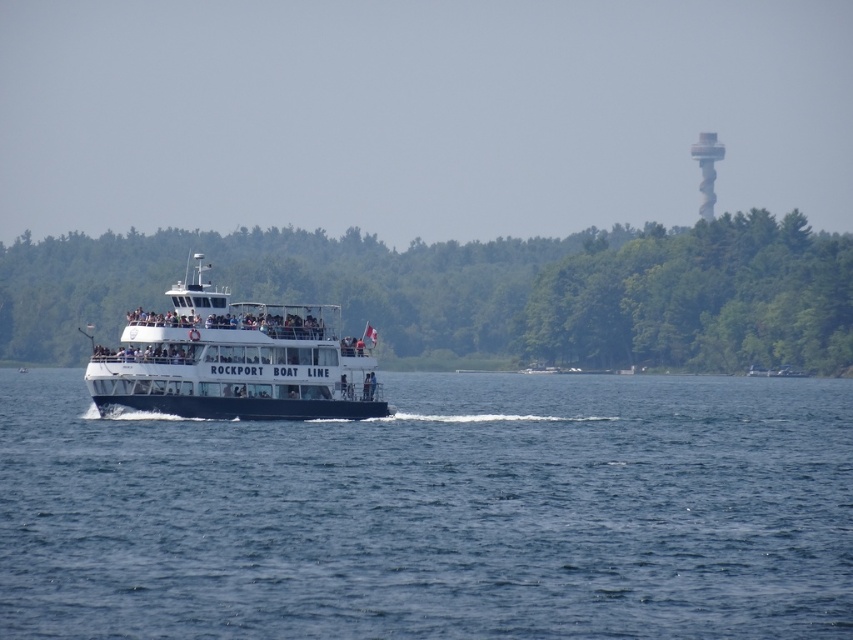
You are a photographer planning to take a landscape photo of the blue water at center and the green leafy trees at center from the ferry. The camera you have can focus on objects up to 60 meters away. Will both subjects be in focus?

The distance between blue water at center and green leafy trees at center is 61.36 meters. Since the camera can only focus up to 60 meters, the subjects are slightly beyond the camera range. Adjust your position or use a different lens to ensure both are in focus.

You are a photographer trying to capture the Skylon Tower in the background. You notice the blue water at center and the green leafy trees at center are blocking your view. Which object should you move closer to in order to reduce their obstruction?

To reduce the obstruction, you should move closer to the green leafy trees at center because they are larger than the blue water at center, so moving closer to them would make them appear smaller in your frame, allowing the Skylon Tower to be more visible.

You are standing on the deck of the ferry boat and want to estimate how far the blue water at center is from you. Based on the scene, what is the approximate distance?

The blue water at center is approximately 46.98 meters away from the viewer.